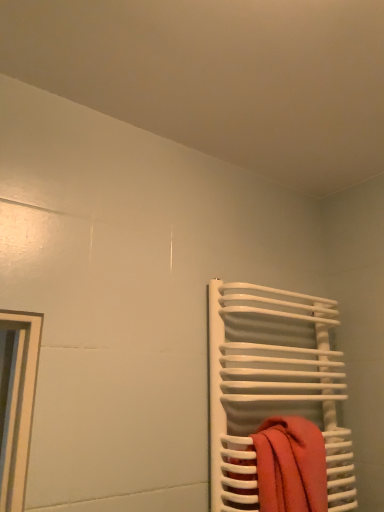
Question: Is there a large distance between white glossy towel rack at right and orange cotton towel at right?

Choices:
 (A) yes
 (B) no

Answer: (B)

Question: Does white glossy towel rack at right lie in front of orange cotton towel at right?

Choices:
 (A) no
 (B) yes

Answer: (A)

Question: From the image's perspective, would you say white glossy towel rack at right is positioned over orange cotton towel at right?

Choices:
 (A) yes
 (B) no

Answer: (A)

Question: Is white glossy towel rack at right behind orange cotton towel at right?

Choices:
 (A) no
 (B) yes

Answer: (B)

Question: Is white glossy towel rack at right shorter than orange cotton towel at right?

Choices:
 (A) yes
 (B) no

Answer: (B)

Question: From the image's perspective, does white glossy towel rack at right appear lower than orange cotton towel at right?

Choices:
 (A) yes
 (B) no

Answer: (B)

Question: Does orange cotton towel at right have a lesser height compared to white glossy towel rack at right?

Choices:
 (A) no
 (B) yes

Answer: (B)

Question: Does orange cotton towel at right lie behind white glossy towel rack at right?

Choices:
 (A) yes
 (B) no

Answer: (B)

Question: Is orange cotton towel at right aimed at white glossy towel rack at right?

Choices:
 (A) no
 (B) yes

Answer: (A)

Question: From a real-world perspective, is orange cotton towel at right located higher than white glossy towel rack at right?

Choices:
 (A) no
 (B) yes

Answer: (A)

Question: Is orange cotton towel at right touching white glossy towel rack at right?

Choices:
 (A) yes
 (B) no

Answer: (B)

Question: Is orange cotton towel at right at the right side of white glossy towel rack at right?

Choices:
 (A) yes
 (B) no

Answer: (B)

Question: From a real-world perspective, is orange cotton towel at right physically located above or below white glossy towel rack at right?

Choices:
 (A) above
 (B) below

Answer: (B)